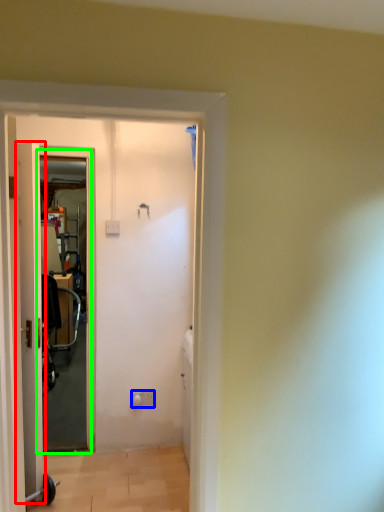
Question: Based on their relative distances, which object is nearer to door (highlighted by a red box)? Choose from electric outlet (highlighted by a blue box) and screen door (highlighted by a green box).

Choices:
 (A) electric outlet
 (B) screen door

Answer: (B)